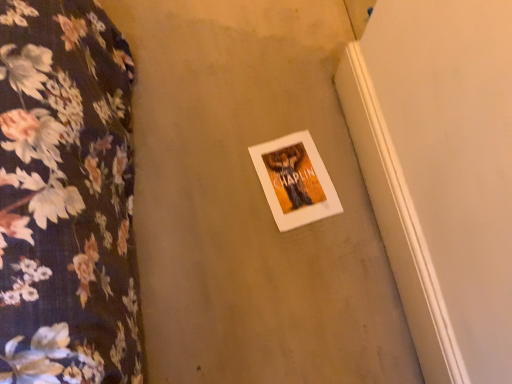
The image size is (512, 384). I want to click on unoccupied area in front of white paper at center, so click(284, 253).